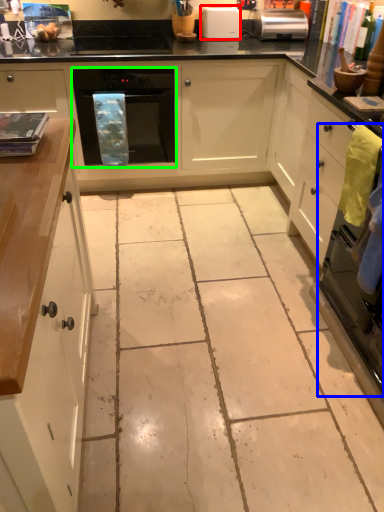
Question: Estimate the real-world distances between objects in this image. Which object is farther from kitchen appliance (highlighted by a red box), oven (highlighted by a blue box) or home appliance (highlighted by a green box)?

Choices:
 (A) oven
 (B) home appliance

Answer: (A)